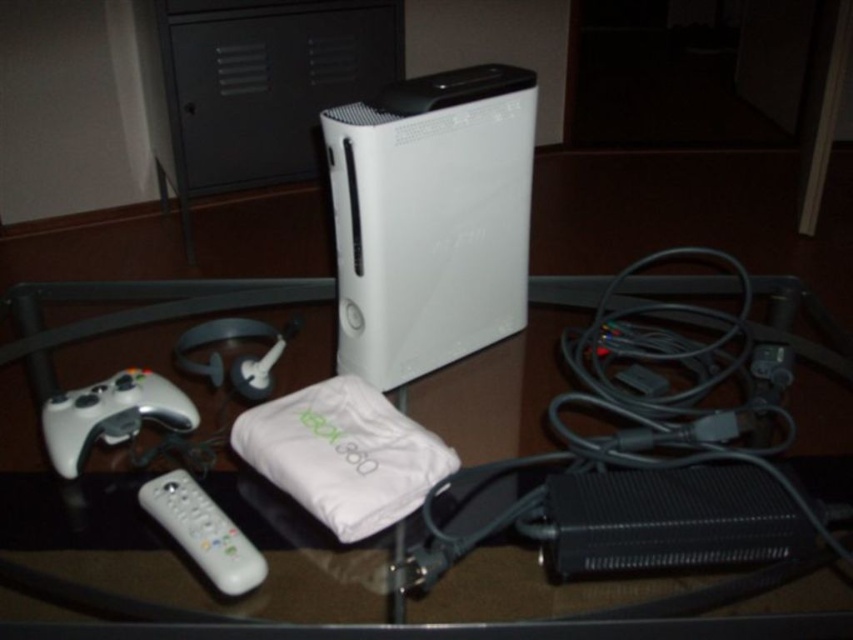
What is the exact 2D coordinate of the white matte wii at center?

The white matte wii at center is located at the exact 2D coordinate of point (430, 218).

You are setting up a new gaming setup. You have a white matte wii at center and a transparent glass table at center. Which object is placed on top of the other?

The white matte wii at center is located above transparent glass table at center, so it is placed on top of the transparent glass table at center.

You are setting up a gaming station and need to place your white plastic remote at lower left on the transparent glass table at center. Can you fit it there without moving the table?

The transparent glass table at center and white plastic remote at lower left are 28.24 centimeters apart, so the remote can be placed on the table as there is sufficient space between them.